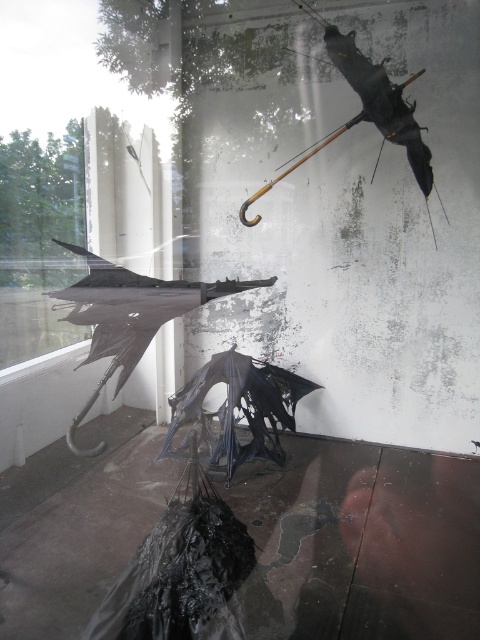
You are an art curator standing at the entrance of the gallery. You notice two points marked in the installation. Which point is closer to you, point (34, 252) or point (273, 368)?

Point (273, 368) is closer to you because the description states that point (34, 252) is behind point (273, 368).

You are an art critic standing in the gallery and notice two points marked on the floor. The first point is at coordinate point (99,442) and the second at point (210,419). If you were to walk from the first point to the second, would you be moving towards the wall or away from it?

Since point (99,442) is behind point (210,419), moving from the first to the second point means you are moving towards the wall.

You are standing in the gallery and want to touch the point at coordinates point (78, 284). If you extend your arm fully, which reaches 2.5 feet, will you be able to reach it?

The point (78, 284) is 7.41 feet away from you, which is farther than your arm can reach. You will not be able to touch it.